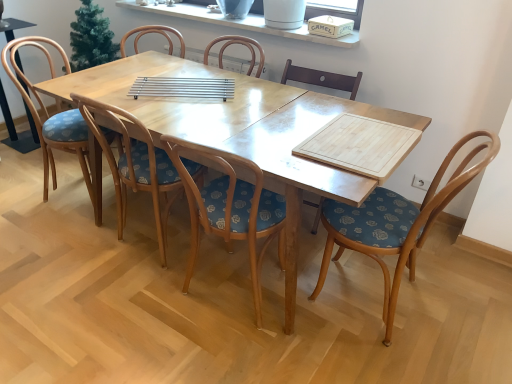
Question: In terms of height, does wooden chair with floral cushion at center, the first chair from the left, look taller or shorter compared to wooden chair at left?

Choices:
 (A) short
 (B) tall

Answer: (B)

Question: Is wooden chair with floral cushion at center, which is the 5th chair in right-to-left order, spatially inside wooden chair at left, or outside of it?

Choices:
 (A) inside
 (B) outside

Answer: (B)

Question: Which of these objects is positioned farthest from the wooden chair with floral cushion at center, the first chair from the left?

Choices:
 (A) wooden chair with floral upholstery at center, positioned as the second chair in left-to-right order
 (B) light wood table at center
 (C) woodenwoodenchair at right, the 1th chair in the right-to-left sequence
 (D) wooden chair with floral upholstery at center, the 3th chair in the left-to-right sequence
 (E) wooden chair at left

Answer: (C)

Question: Considering the real-world distances, which object is farthest from the wooden at center, the 4th chair when ordered from left to right?

Choices:
 (A) wooden chair with floral upholstery at center, marked as the third chair in a right-to-left arrangement
 (B) wooden chair with floral upholstery at center, positioned as the second chair in left-to-right order
 (C) light wood table at center
 (D) white ceramic window sill at upper center
 (E) wooden chair at left

Answer: (E)